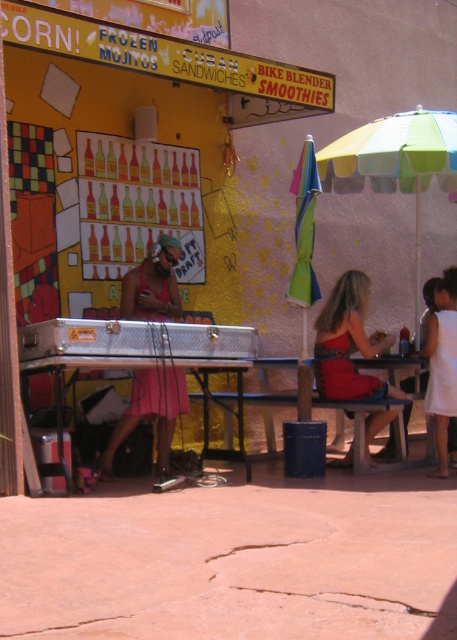
Where is `white cotton dress at lower right`? white cotton dress at lower right is located at coordinates (441, 364).

What do you see at coordinates (441, 364) in the screenshot?
I see `white cotton dress at lower right` at bounding box center [441, 364].

What do you see at coordinates (441, 364) in the screenshot?
I see `white cotton dress at lower right` at bounding box center [441, 364].

Where is `white cotton dress at lower right`? white cotton dress at lower right is located at coordinates [x=441, y=364].

Does matte red dress at lower right appear on the left side of metallic silver table at center?

Incorrect, matte red dress at lower right is not on the left side of metallic silver table at center.

Between point (363, 298) and point (238, 456), which one is positioned in front?

Positioned in front is point (238, 456).

This screenshot has height=640, width=457. What are the coordinates of `matte red dress at lower right` in the screenshot? It's located at (347, 342).

Between multicolored striped umbrella at right and metallic silver table at center, which one is positioned lower?

Positioned lower is metallic silver table at center.

Can you confirm if multicolored striped umbrella at right is shorter than metallic silver table at center?

Correct, multicolored striped umbrella at right is not as tall as metallic silver table at center.

Looking at this image, who is more distant from viewer, (387, 131) or (41, 365)?

Point (387, 131)

The image size is (457, 640). Find the location of `multicolored striped umbrella at right`. multicolored striped umbrella at right is located at coordinates (394, 163).